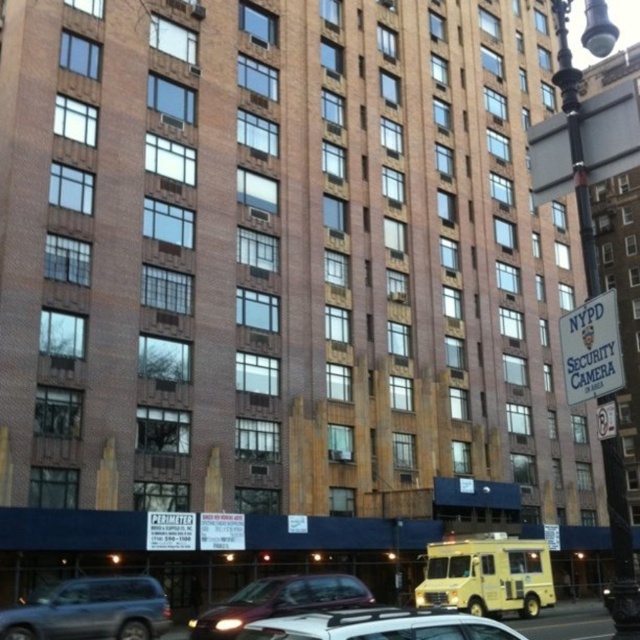
Does yellow matte food truck at lower right have a lesser width compared to black metal lamp post at right?

Correct, yellow matte food truck at lower right's width is less than black metal lamp post at right's.

Is yellow matte food truck at lower right below black metal lamp post at right?

Indeed, yellow matte food truck at lower right is positioned under black metal lamp post at right.

Image resolution: width=640 pixels, height=640 pixels. I want to click on yellow matte food truck at lower right, so click(x=486, y=576).

Find the location of `yellow matte food truck at lower right`. yellow matte food truck at lower right is located at coordinates (486, 576).

Is yellow matte food truck at lower right shorter than white matte car at lower center?

Indeed, yellow matte food truck at lower right has a lesser height compared to white matte car at lower center.

Is yellow matte food truck at lower right positioned in front of white matte car at lower center?

That is False.

Is point (481, 573) positioned in front of point (419, 634)?

No, (481, 573) is further to viewer.

I want to click on yellow matte food truck at lower right, so click(486, 576).

Who is positioned more to the left, black metal lamp post at right or maroon matte sedan at lower center?

From the viewer's perspective, maroon matte sedan at lower center appears more on the left side.

You are a GUI agent. You are given a task and a screenshot of the screen. Output one action in this format:
    pyautogui.click(x=<x>, y=<y>)
    Task: Click on the black metal lamp post at right
    
    Given the screenshot: What is the action you would take?
    pyautogui.click(x=576, y=144)